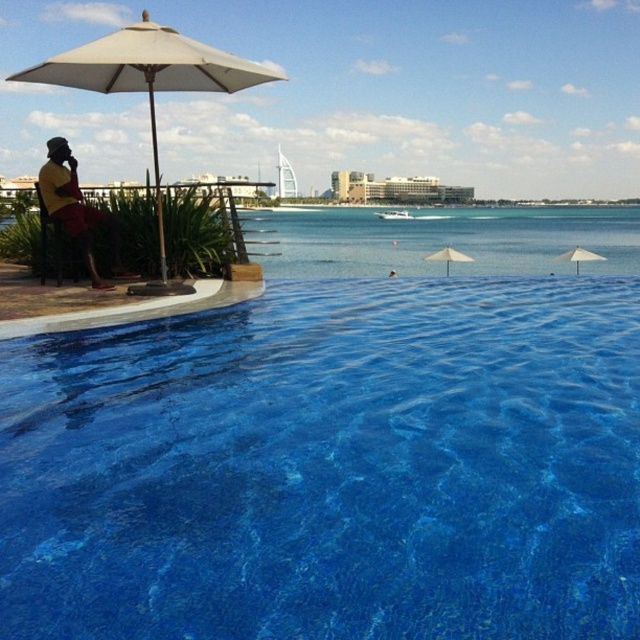
Is beige fabric umbrella at upper left in front of white fabric umbrella at right?

Yes.

Between beige fabric umbrella at upper left and white fabric umbrella at right, which one appears on the right side from the viewer's perspective?

white fabric umbrella at right

Identify the location of beige fabric umbrella at upper left. This screenshot has height=640, width=640. (148, 74).

I want to click on beige fabric umbrella at upper left, so click(x=148, y=74).

Who is shorter, transparent glass water at center or beige fabric umbrella at upper left?

With less height is beige fabric umbrella at upper left.

Locate an element on the screen. The width and height of the screenshot is (640, 640). transparent glass water at center is located at coordinates (442, 241).

Measure the distance between point [451,237] and camera.

The distance of point [451,237] from camera is 20.76 meters.

At what (x,y) coordinates should I click in order to perform the action: click on transparent glass water at center. Please return your answer as a coordinate pair (x, y). This screenshot has height=640, width=640. Looking at the image, I should click on (442, 241).

Which of these two, blue glossy water at center or beige fabric umbrella at upper left, stands taller?

beige fabric umbrella at upper left is taller.

Can you confirm if blue glossy water at center is positioned above beige fabric umbrella at upper left?

Incorrect, blue glossy water at center is not positioned above beige fabric umbrella at upper left.

Find the location of a particular element. blue glossy water at center is located at coordinates (330, 467).